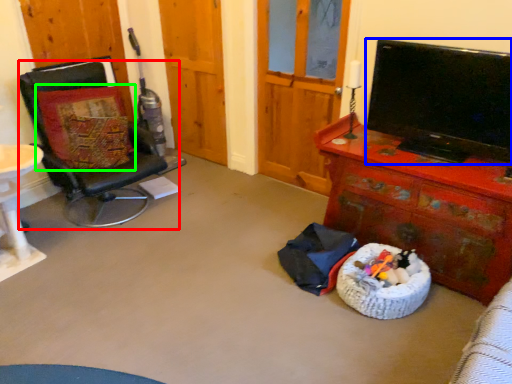
Question: Which object is the farthest from chair (highlighted by a red box)? Choose among these: television (highlighted by a blue box) or pillow (highlighted by a green box).

Choices:
 (A) television
 (B) pillow

Answer: (A)